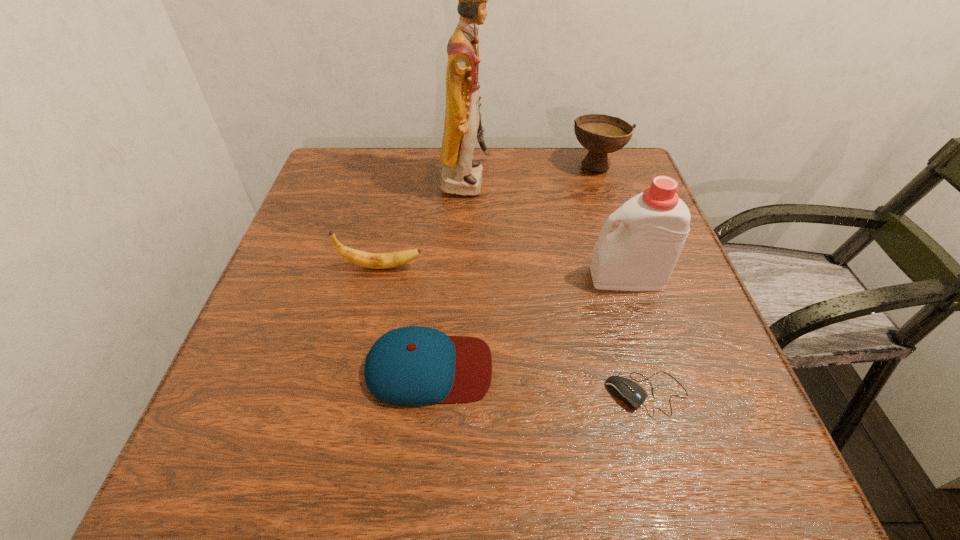
In order to click on free space that satisfies the following two spatial constraints: 1. on the front-facing side of the nutcracker; 2. on the back side of the shortest object in this screenshot , I will do point(458,394).

The image size is (960, 540). In order to click on free space that satisfies the following two spatial constraints: 1. with the bill of the fifth tallest object facing forward; 2. on the right side of the computer mouse in this screenshot , I will do `click(426, 394)`.

Locate an element on the screen. This screenshot has height=540, width=960. blank area in the image that satisfies the following two spatial constraints: 1. on the peel of the computer mouse from the top; 2. on the left side of the fourth tallest object is located at coordinates (353, 394).

Where is `free location that satisfies the following two spatial constraints: 1. on the front-facing side of the nutcracker; 2. on the right side of the shortest object`? free location that satisfies the following two spatial constraints: 1. on the front-facing side of the nutcracker; 2. on the right side of the shortest object is located at coordinates tap(458, 394).

The height and width of the screenshot is (540, 960). I want to click on blank space that satisfies the following two spatial constraints: 1. on the peel of the third shortest object from the top; 2. on the left side of the shortest object, so click(x=353, y=394).

Identify the location of vacant region that satisfies the following two spatial constraints: 1. on the front side of the fourth shortest object; 2. with the bill of the baseball cap facing forward. Image resolution: width=960 pixels, height=540 pixels. (664, 368).